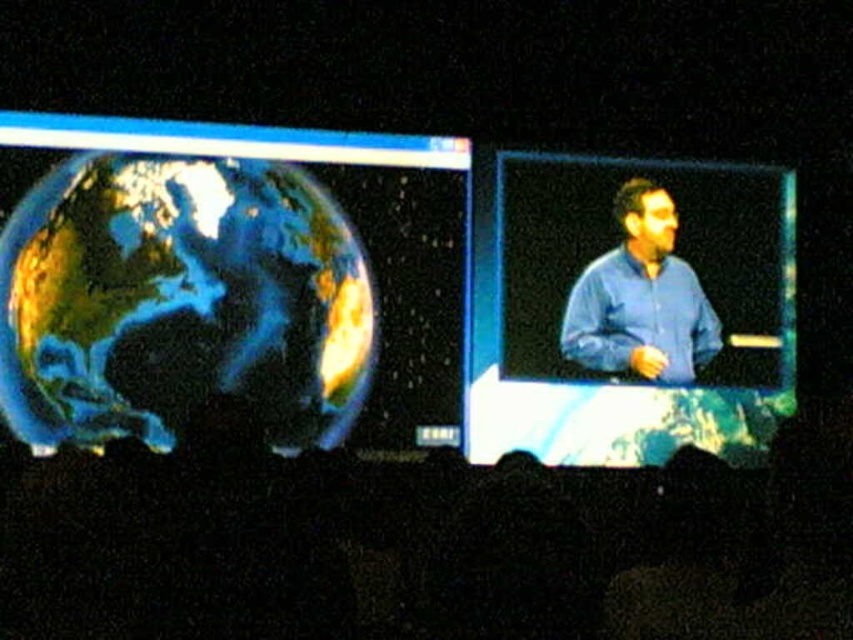
Question: Considering the relative positions of smooth fabric screen at center and blue fabric screen at right in the image provided, where is smooth fabric screen at center located with respect to blue fabric screen at right?

Choices:
 (A) right
 (B) left

Answer: (B)

Question: Which object is the closest to the smooth fabric screen at center?

Choices:
 (A) earth-like globe at left
 (B) blue shirt at center
 (C) blue fabric screen at right

Answer: (A)

Question: Which point is farther to the camera?

Choices:
 (A) blue shirt at center
 (B) smooth fabric screen at center
 (C) earth-like globe at left

Answer: (A)

Question: Which is farther from the blue fabric screen at right?

Choices:
 (A) blue shirt at center
 (B) earth-like globe at left

Answer: (B)

Question: Is blue fabric screen at right wider than blue shirt at center?

Choices:
 (A) no
 (B) yes

Answer: (B)

Question: Where is earth-like globe at left located in relation to blue shirt at center in the image?

Choices:
 (A) above
 (B) below

Answer: (B)